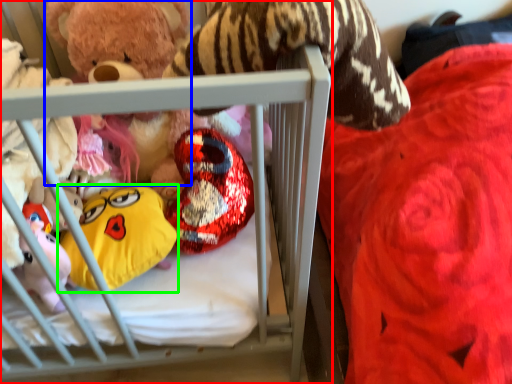
Question: Which object is the closest to the infant bed (highlighted by a red box)? Choose among these: toy (highlighted by a blue box) or toy (highlighted by a green box).

Choices:
 (A) toy
 (B) toy

Answer: (B)